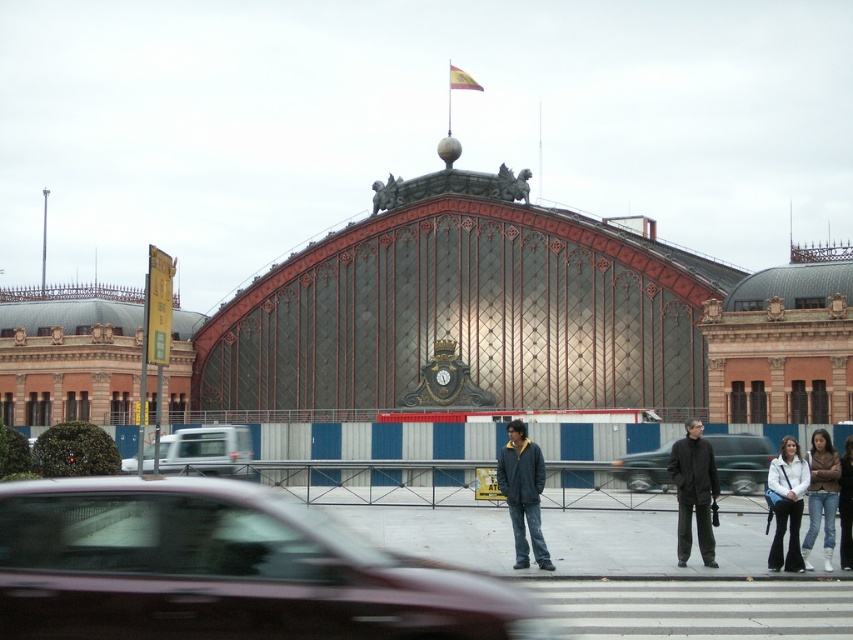
Question: Based on their relative distances, which object is nearer to the jeans at center?

Choices:
 (A) white leather jacket at lower right
 (B) dark blue denim jeans at center

Answer: (A)

Question: Which point is closer to the camera?

Choices:
 (A) jeans at center
 (B) dark blue denim jeans at center
 (C) dark gray jacket at center

Answer: (B)

Question: Does white leather jacket at lower right lie in front of denim jacket at lower right?

Choices:
 (A) yes
 (B) no

Answer: (A)

Question: Which object is closer to the camera taking this photo?

Choices:
 (A) jeans at center
 (B) metallic maroon sedan at center
 (C) metallic gray car at center

Answer: (B)

Question: Considering the relative positions of dark gray jacket at center and jeans at center in the image provided, where is dark gray jacket at center located with respect to jeans at center?

Choices:
 (A) above
 (B) below

Answer: (A)

Question: Can you confirm if white matte van at center is wider than white leather jacket at lower right?

Choices:
 (A) yes
 (B) no

Answer: (A)